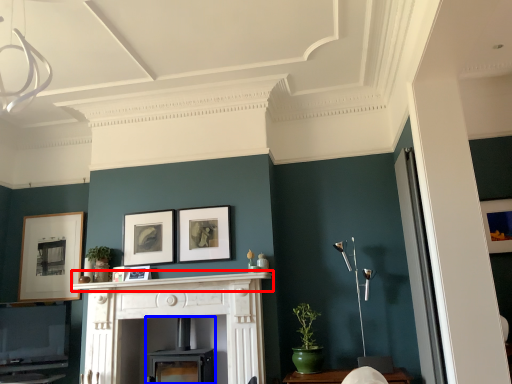
Question: Which of the following is the closest to the observer, mantle (highlighted by a red box) or fireplace (highlighted by a blue box)?

Choices:
 (A) mantle
 (B) fireplace

Answer: (A)